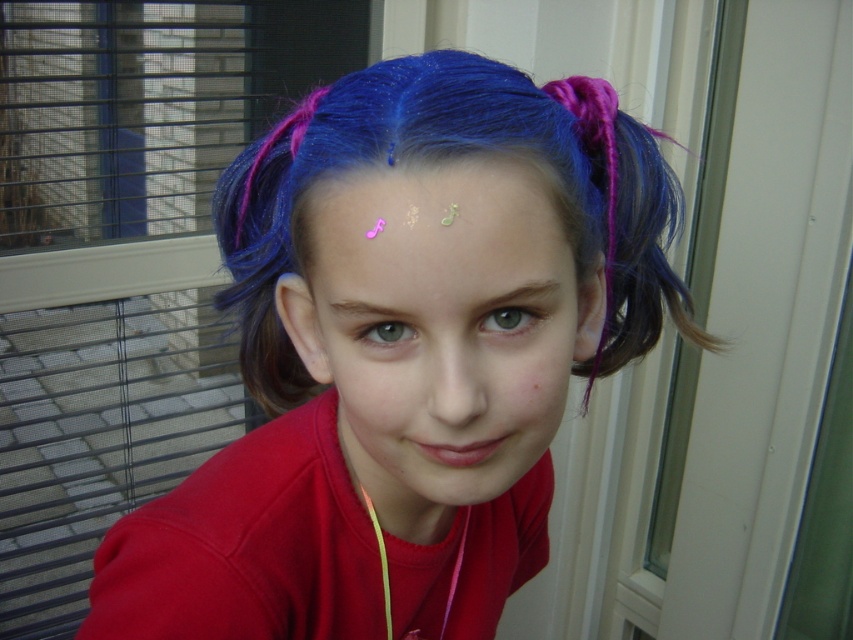
Can you confirm if blue shiny hair at center is positioned above brown matte eyebrow at upper center?

Incorrect, blue shiny hair at center is not positioned above brown matte eyebrow at upper center.

Is blue shiny hair at center thinner than brown matte eyebrow at upper center?

In fact, blue shiny hair at center might be wider than brown matte eyebrow at upper center.

Who is more forward, (x=331, y=157) or (x=550, y=292)?

Point (x=331, y=157)

Image resolution: width=853 pixels, height=640 pixels. I want to click on blue shiny hair at center, so click(x=402, y=355).

Can you confirm if shiny glitter face at center is wider than brown matte eyebrow at upper center?

Yes.

Which is more to the left, shiny glitter face at center or brown matte eyebrow at upper center?

shiny glitter face at center

Is point (361, 346) positioned after point (474, 292)?

Yes.

Identify the location of shiny glitter face at center. (437, 326).

Does point (312, 563) come in front of point (532, 388)?

No, (312, 563) is further to viewer.

Between point (270, 141) and point (535, 385), which one is positioned in front?

Point (535, 385) is in front.

Describe the element at coordinates (402, 355) in the screenshot. I see `blue shiny hair at center` at that location.

Where is `blue shiny hair at center`? The height and width of the screenshot is (640, 853). blue shiny hair at center is located at coordinates (402, 355).